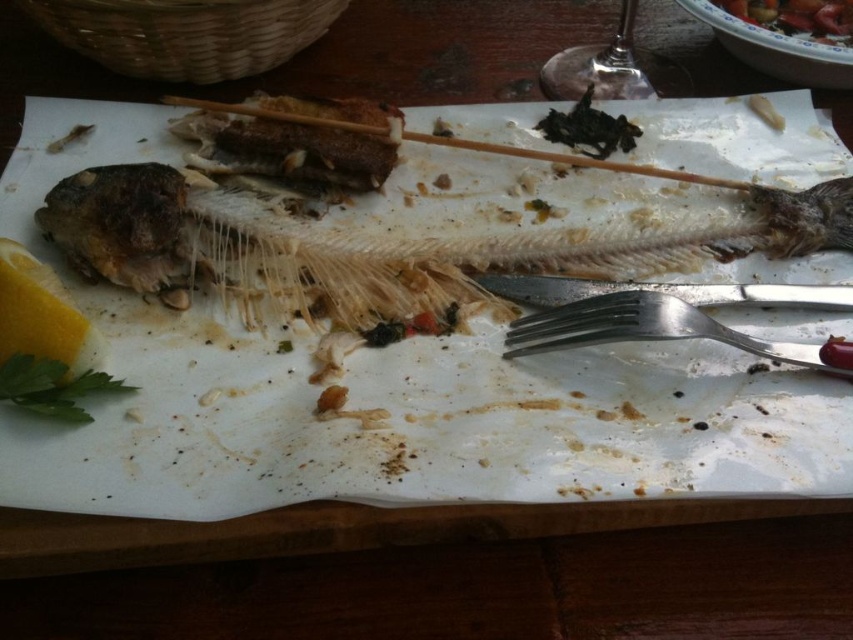
Is silver metallic fork at lower right to the left of green leafy parsley at lower left from the viewer's perspective?

In fact, silver metallic fork at lower right is to the right of green leafy parsley at lower left.

Which is more to the right, silver metallic fork at lower right or green leafy parsley at lower left?

Positioned to the right is silver metallic fork at lower right.

The image size is (853, 640). What are the coordinates of `silver metallic fork at lower right` in the screenshot? It's located at (654, 330).

How much distance is there between white paper plate at center and yellow matte lemon at lower left?

white paper plate at center is 34.61 centimeters away from yellow matte lemon at lower left.

Is point (227, 410) positioned after point (57, 344)?

Yes, it is.

You are a GUI agent. You are given a task and a screenshot of the screen. Output one action in this format:
    pyautogui.click(x=<x>, y=<y>)
    Task: Click on the white paper plate at center
    Image resolution: width=853 pixels, height=640 pixels.
    Given the screenshot: What is the action you would take?
    pyautogui.click(x=381, y=396)

Is silver metallic fork at lower right positioned at the back of yellow matte lemon at lower left?

Yes, silver metallic fork at lower right is further from the viewer.

Who is positioned more to the right, silver metallic fork at lower right or yellow matte lemon at lower left?

From the viewer's perspective, silver metallic fork at lower right appears more on the right side.

Describe the element at coordinates (654, 330) in the screenshot. I see `silver metallic fork at lower right` at that location.

Locate an element on the screen. This screenshot has width=853, height=640. silver metallic fork at lower right is located at coordinates (654, 330).